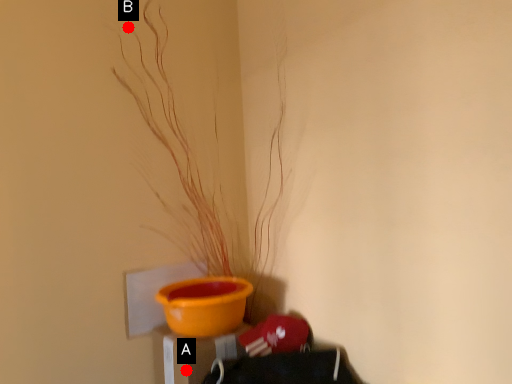
Question: Two points are circled on the image, labeled by A and B beside each circle. Which of the following is the closest to the observer?

Choices:
 (A) A is closer
 (B) B is closer

Answer: (A)